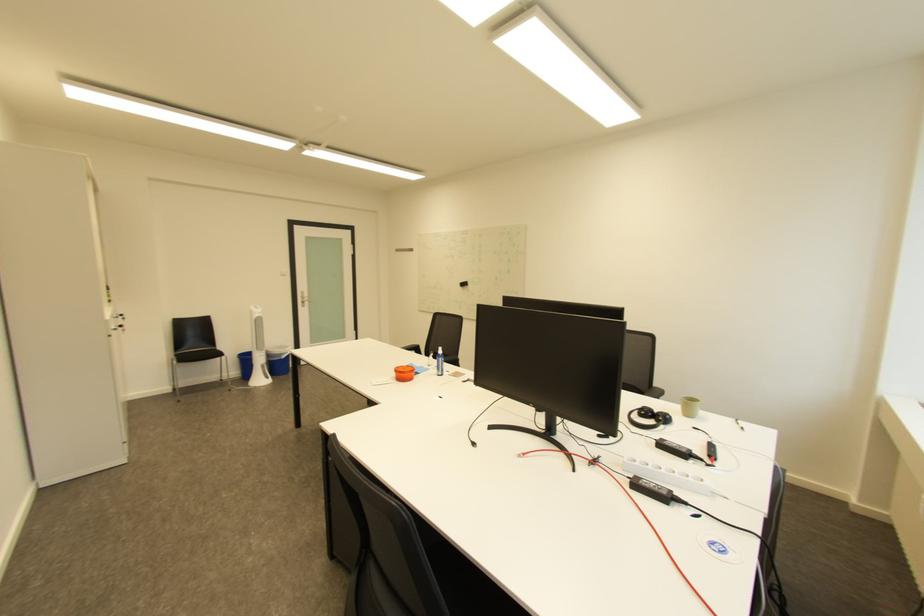
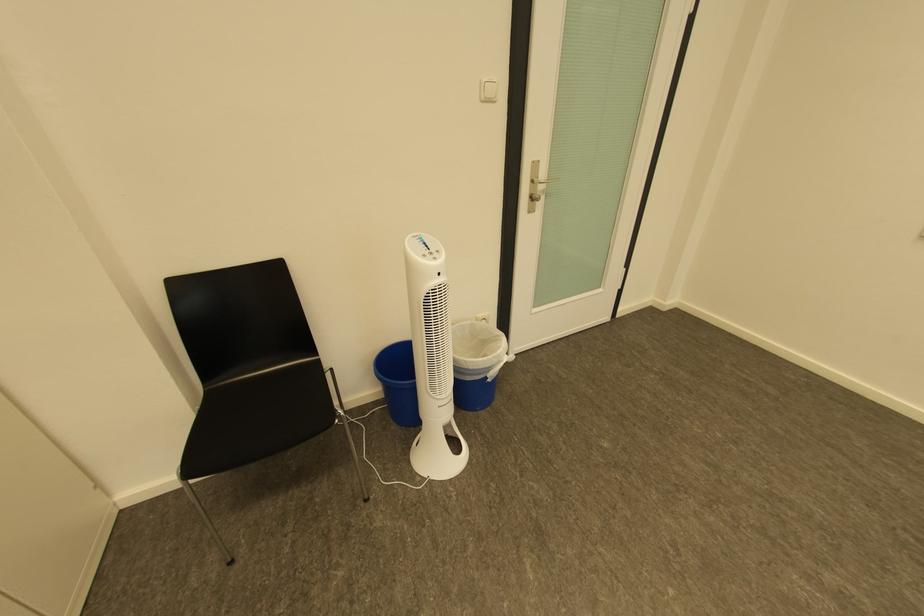
In a continuous first-person perspective shot, in which direction is the camera moving?

The movement direction of the cameraman is left, forward.